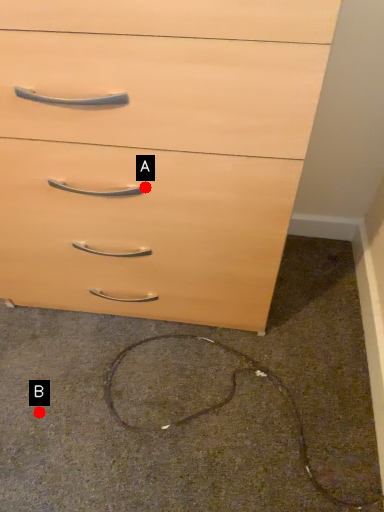
Question: Two points are circled on the image, labeled by A and B beside each circle. Which point appears farthest from the camera in this image?

Choices:
 (A) A is further
 (B) B is further

Answer: (B)